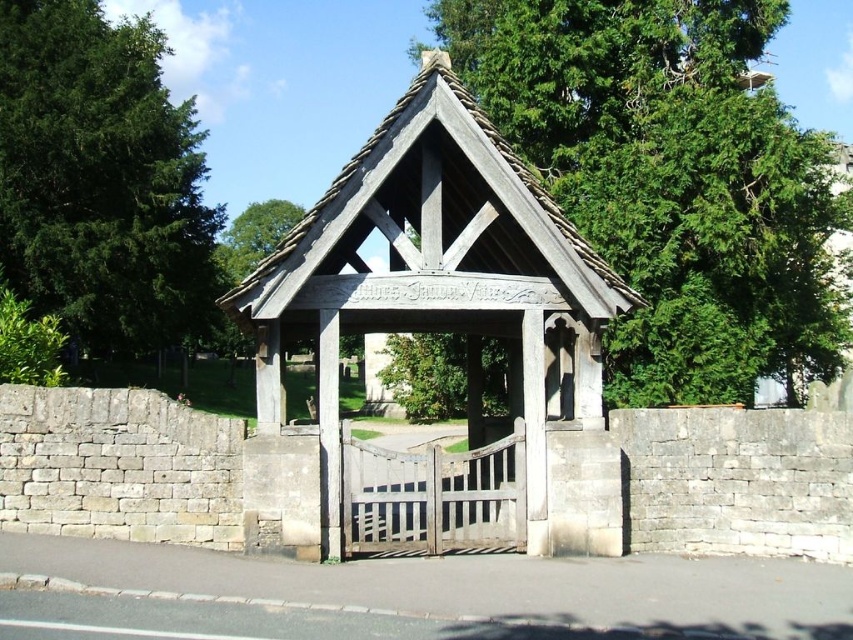
Question: Among these objects, which one is farthest from the camera?

Choices:
 (A) wooden gazebo at center
 (B) green leafy tree at upper center

Answer: (B)

Question: Which point appears farthest from the camera in this image?

Choices:
 (A) (151, 326)
 (B) (656, 154)
 (C) (277, 417)

Answer: (A)

Question: Can you confirm if green leafy tree at upper center is smaller than green leafy tree at left?

Choices:
 (A) yes
 (B) no

Answer: (A)

Question: Which point is farther from the camera taking this photo?

Choices:
 (A) (828, 147)
 (B) (474, 268)

Answer: (A)

Question: Is green leafy tree at upper center bigger than wooden gazebo at center?

Choices:
 (A) no
 (B) yes

Answer: (B)

Question: Does green leafy tree at upper center have a lesser width compared to wooden gazebo at center?

Choices:
 (A) yes
 (B) no

Answer: (B)